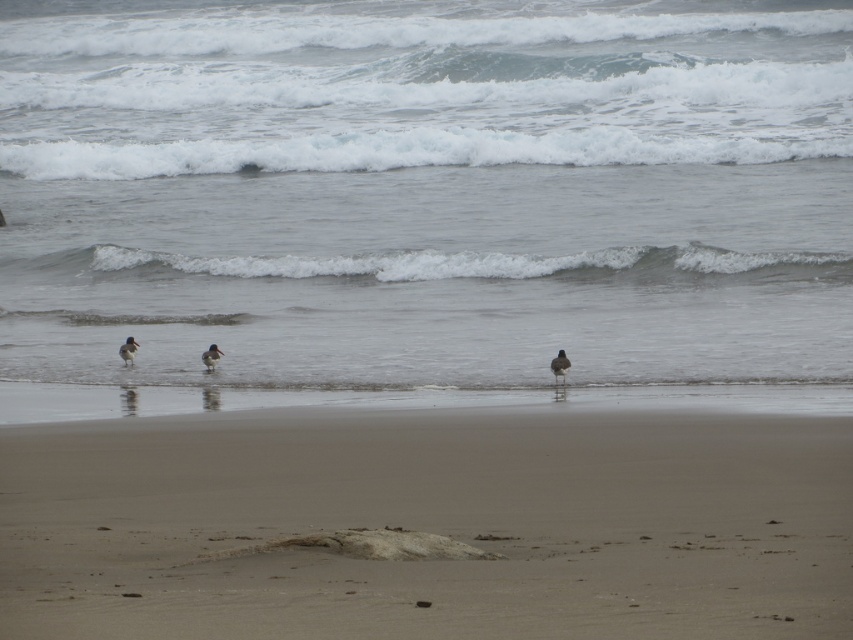
Question: Which of these objects is positioned closest to the white frothy wave at center?

Choices:
 (A) brown speckled feather at center
 (B) smooth sand at lower center
 (C) brown speckled beak at left
 (D) brown speckled feathered bird at center

Answer: (C)

Question: Among these objects, which one is nearest to the camera?

Choices:
 (A) brown speckled feather at center
 (B) brown speckled feathered bird at center
 (C) brown speckled beak at left
 (D) smooth sand at lower center

Answer: (D)

Question: Does gray matte water at center appear under brown speckled beak at left?

Choices:
 (A) yes
 (B) no

Answer: (B)

Question: Does brown speckled feathered bird at center lie behind brown speckled beak at left?

Choices:
 (A) yes
 (B) no

Answer: (B)

Question: Does brown speckled feathered bird at center appear over brown speckled beak at left?

Choices:
 (A) yes
 (B) no

Answer: (B)

Question: Which object appears closest to the camera in this image?

Choices:
 (A) brown speckled feathered bird at center
 (B) smooth sand at lower center

Answer: (B)